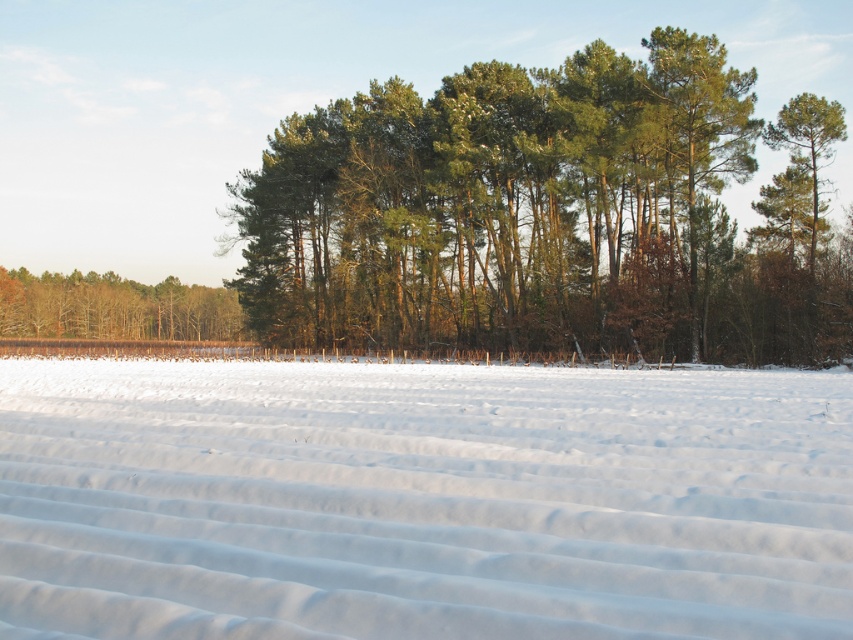
Between green textured trees at center and brown matte trees at left, which one is positioned lower?

Positioned lower is brown matte trees at left.

Measure the distance between point (x=268, y=321) and camera.

The distance of point (x=268, y=321) from camera is 67.51 meters.

Who is more distant from viewer, (509, 323) or (113, 332)?

The point (113, 332) is more distant.

Where is `green textured trees at center`? The height and width of the screenshot is (640, 853). green textured trees at center is located at coordinates (546, 214).

Is white smooth snow at center to the right of green textured trees at center from the viewer's perspective?

Incorrect, white smooth snow at center is not on the right side of green textured trees at center.

Is point (316, 371) positioned in front of point (490, 259)?

Yes, it is in front of point (490, 259).

Describe the element at coordinates (421, 500) in the screenshot. I see `white smooth snow at center` at that location.

Find the location of `white smooth snow at center`. white smooth snow at center is located at coordinates (421, 500).

Consider the image. Is white smooth snow at center smaller than brown matte trees at left?

Yes, white smooth snow at center is smaller than brown matte trees at left.

Does white smooth snow at center have a lesser width compared to brown matte trees at left?

Yes.

Does point (206, 404) lie behind point (228, 316)?

No, it is not.

The height and width of the screenshot is (640, 853). Find the location of `white smooth snow at center`. white smooth snow at center is located at coordinates (421, 500).